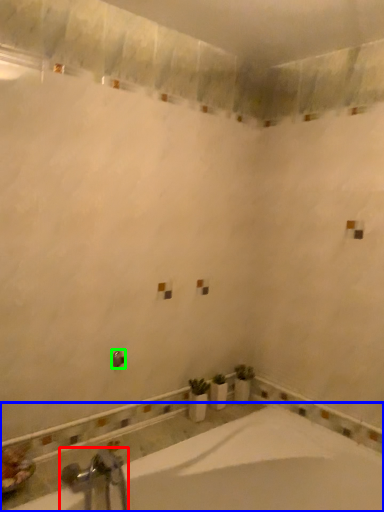
Question: Considering the real-world distances, which object is farthest from tap (highlighted by a red box)? bathtub (highlighted by a blue box) or shower (highlighted by a green box)?

Choices:
 (A) bathtub
 (B) shower

Answer: (B)